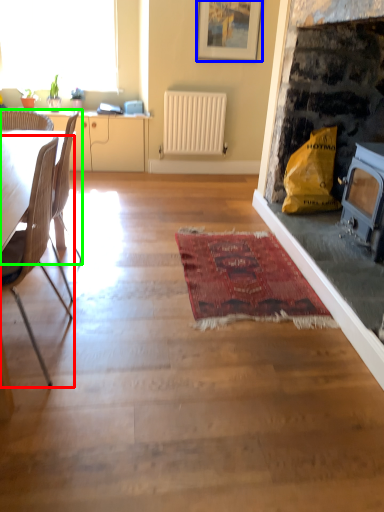
Question: Considering the real-world distances, which object is farthest from chair (highlighted by a red box)? picture frame (highlighted by a blue box) or chair (highlighted by a green box)?

Choices:
 (A) picture frame
 (B) chair

Answer: (A)